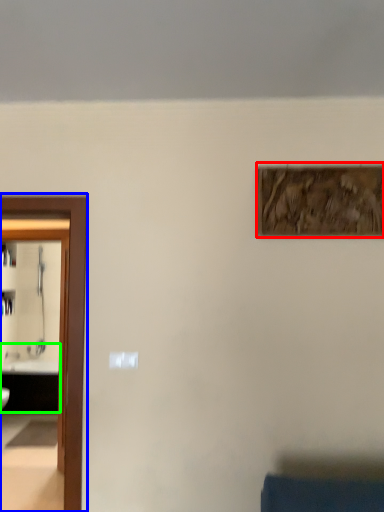
Question: Estimate the real-world distances between objects in this image. Which object is closer to picture frame (highlighted by a red box), elevator (highlighted by a blue box) or sink (highlighted by a green box)?

Choices:
 (A) elevator
 (B) sink

Answer: (A)